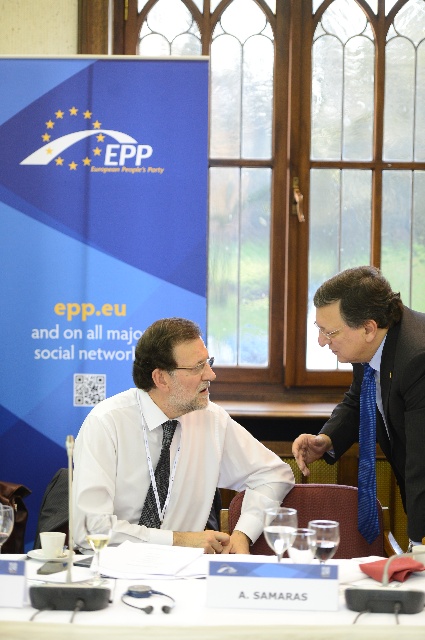
From the picture: You are organizing a conference and need to place a name tag on the blue textured tie at right and the smooth skin hand at center. Which object has a smaller width, requiring a smaller name tag?

The blue textured tie at right has a smaller width than the smooth skin hand at center, so it requires a smaller name tag.